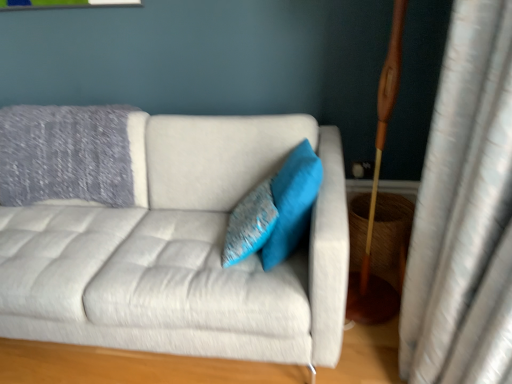
Question: Should I look upward or downward to see turquoise fabric pillow at center, the first pillow when ordered from right to left?

Choices:
 (A) down
 (B) up

Answer: (B)

Question: Is turquoise fabric pillow at center, the first pillow when ordered from right to left, positioned behind textured blue pillow at center, which ranks as the 2th pillow in right-to-left order?

Choices:
 (A) no
 (B) yes

Answer: (A)

Question: Can you confirm if turquoise fabric pillow at center, which ranks as the 2th pillow in left-to-right order, is wider than textured blue pillow at center, the 1th pillow when ordered from left to right?

Choices:
 (A) no
 (B) yes

Answer: (B)

Question: Is turquoise fabric pillow at center, which ranks as the 2th pillow in left-to-right order, oriented towards textured blue pillow at center, the 1th pillow when ordered from left to right?

Choices:
 (A) yes
 (B) no

Answer: (A)

Question: Is textured blue pillow at center, the 1th pillow when ordered from left to right, surrounded by turquoise fabric pillow at center, which ranks as the 2th pillow in left-to-right order?

Choices:
 (A) yes
 (B) no

Answer: (B)

Question: From a real-world perspective, does turquoise fabric pillow at center, the first pillow when ordered from right to left, stand above textured blue pillow at center, the 1th pillow when ordered from left to right?

Choices:
 (A) no
 (B) yes

Answer: (B)

Question: From the image's perspective, is turquoise fabric pillow at center, which ranks as the 2th pillow in left-to-right order, above textured blue pillow at center, the 1th pillow when ordered from left to right?

Choices:
 (A) yes
 (B) no

Answer: (A)

Question: Considering the relative positions of light gray fabric couch at center and turquoise fabric pillow at center, which ranks as the 2th pillow in left-to-right order, in the image provided, is light gray fabric couch at center to the right of turquoise fabric pillow at center, which ranks as the 2th pillow in left-to-right order, from the viewer's perspective?

Choices:
 (A) yes
 (B) no

Answer: (B)

Question: Is light gray fabric couch at center facing away from turquoise fabric pillow at center, the first pillow when ordered from right to left?

Choices:
 (A) no
 (B) yes

Answer: (A)

Question: Is light gray fabric couch at center not inside turquoise fabric pillow at center, which ranks as the 2th pillow in left-to-right order?

Choices:
 (A) no
 (B) yes

Answer: (B)

Question: Is light gray fabric couch at center closer to camera compared to turquoise fabric pillow at center, which ranks as the 2th pillow in left-to-right order?

Choices:
 (A) no
 (B) yes

Answer: (B)

Question: Are light gray fabric couch at center and turquoise fabric pillow at center, which ranks as the 2th pillow in left-to-right order, located far from each other?

Choices:
 (A) yes
 (B) no

Answer: (B)

Question: From a real-world perspective, is light gray fabric couch at center over turquoise fabric pillow at center, which ranks as the 2th pillow in left-to-right order?

Choices:
 (A) no
 (B) yes

Answer: (A)

Question: Is turquoise fabric pillow at center, which ranks as the 2th pillow in left-to-right order, not within light gray fabric couch at center?

Choices:
 (A) no
 (B) yes

Answer: (A)